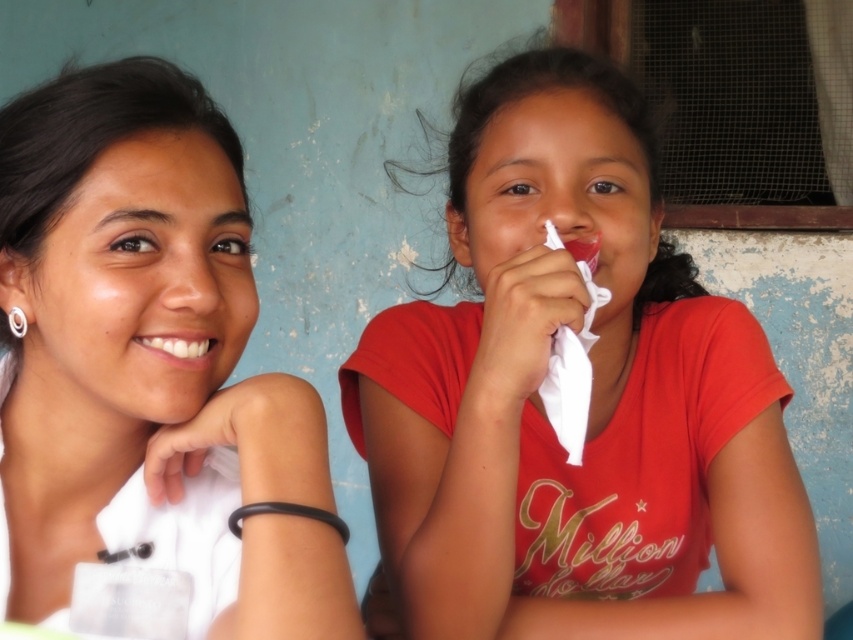
You are standing in front of the scene and want to locate the red matte shirt at center. According to the coordinates given, where would you look to find it?

The red matte shirt at center is located at coordinates point (589, 404).

You are a photographer standing in front of the scene described. You want to capture a closeup of the red matte shirt at center. Based on its distance from you, can you estimate how far you need to step back to ensure the shirt fills the frame properly?

The red matte shirt at center is 76.94 centimeters from the viewer. To ensure it fills the frame properly, you should maintain this distance or adjust your camera zoom accordingly.

You are a photographer trying to capture a closeup of the white matte shirt at upper left and the white glossy teeth at center. Which object should you zoom in on first to ensure it fits entirely within the frame?

The white glossy teeth at center should be zoomed in on first because it is smaller than the white matte shirt at upper left, ensuring it fits within the frame before adjusting for the larger shirt.